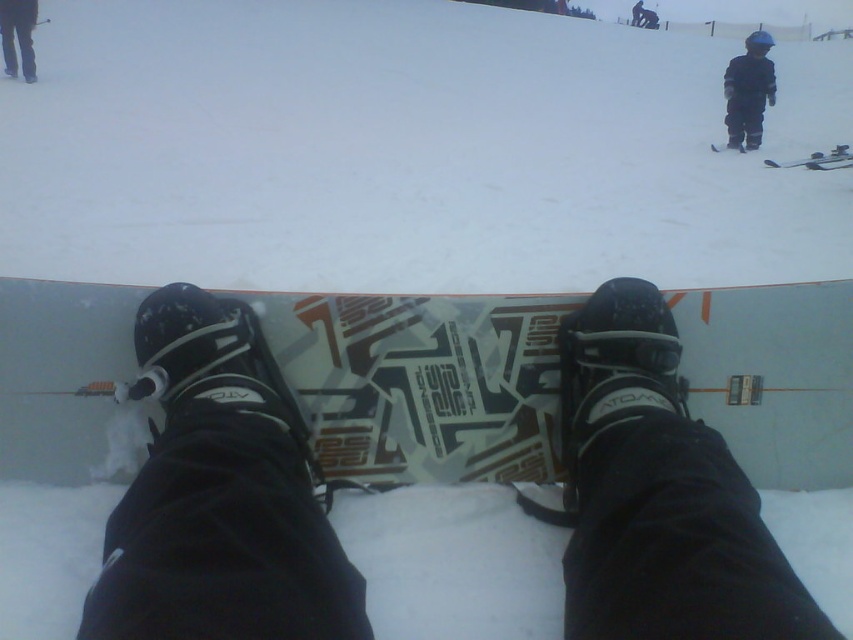
You are a snowboarder getting ready to ride. You notice the matte black snowboard at center and the black fabric pants at upper left. Which object is closer to you?

The matte black snowboard at center is closer to you because it is in front of the black fabric pants at upper left.

You are standing at the edge of a snow slope and see two points marked in the scene. The first point is at coordinate point (495, 440) and the second point is at coordinate point (767, 65). Which point is closer to you?

Point (495, 440) is closer to the camera than point (767, 65).